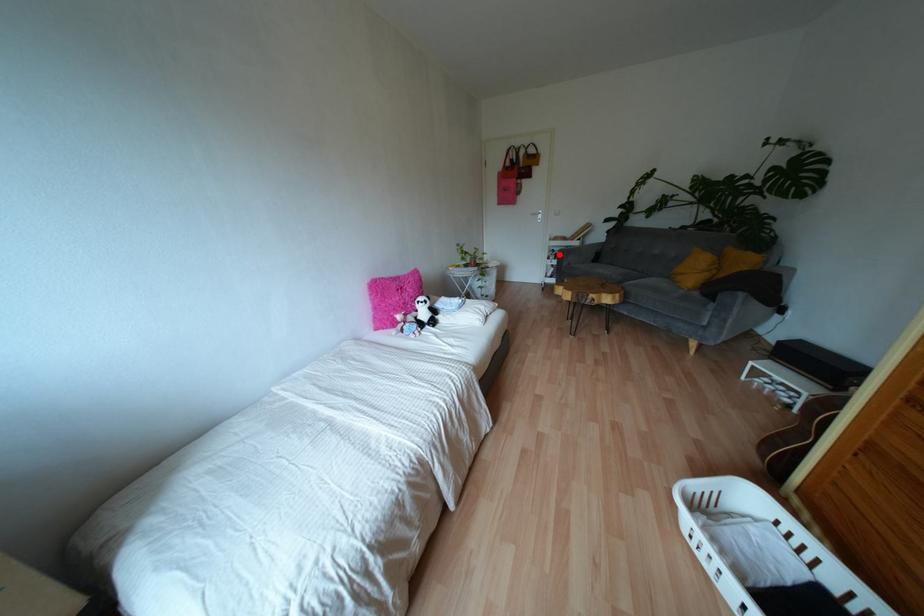
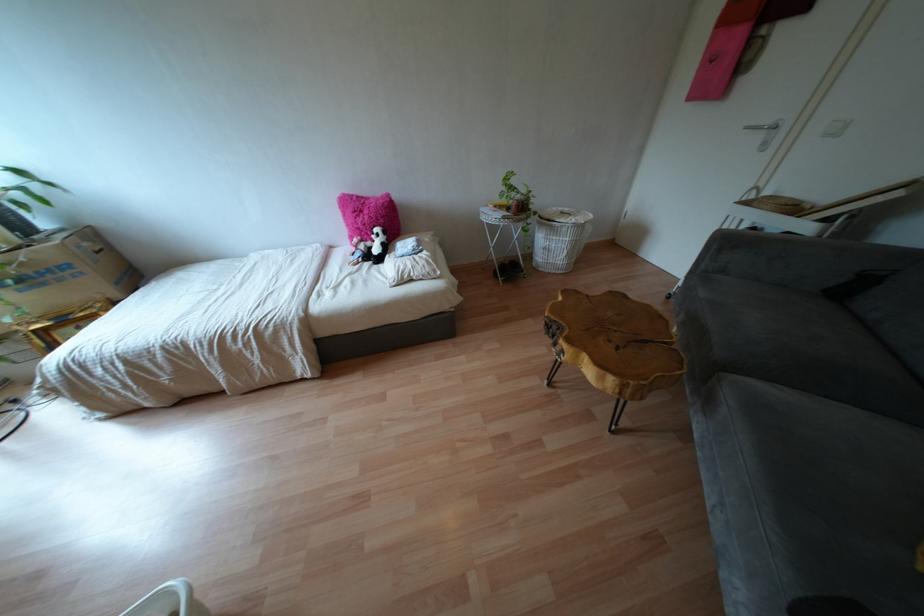
Find the pixel in the second image that matches the highlighted location in the first image.

(723, 243)